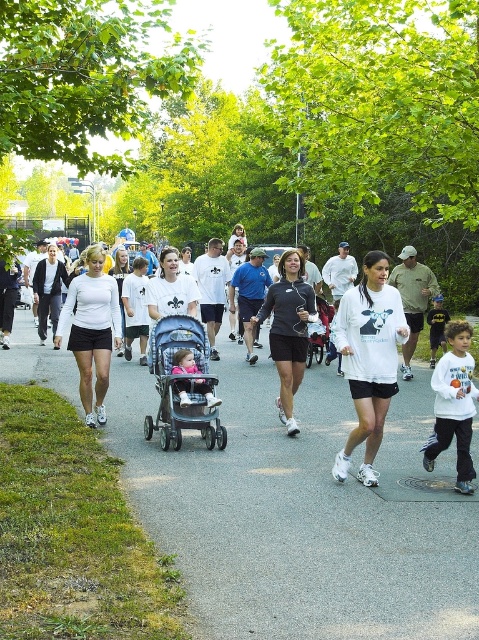
Can you confirm if matte pink stroller at center is positioned to the right of white matte t-shirt at center?

Indeed, matte pink stroller at center is positioned on the right side of white matte t-shirt at center.

Which is behind, point (187, 385) or point (121, 285)?

Positioned behind is point (121, 285).

At what (x,y) coordinates should I click in order to perform the action: click on matte pink stroller at center. Please return your answer as a coordinate pair (x, y). Looking at the image, I should click on (183, 362).

Is white matte long-sleeve shirt at center to the left of white matte shorts at center from the viewer's perspective?

No, white matte long-sleeve shirt at center is not to the left of white matte shorts at center.

What do you see at coordinates (368, 358) in the screenshot? I see `white matte long-sleeve shirt at center` at bounding box center [368, 358].

I want to click on white matte long-sleeve shirt at center, so click(x=368, y=358).

Does blue fabric stroller at center have a larger size compared to matte pink stroller at center?

Yes, blue fabric stroller at center is bigger than matte pink stroller at center.

Between blue fabric stroller at center and matte pink stroller at center, which one is positioned higher?

matte pink stroller at center is above.

Is point (201, 324) positioned after point (177, 385)?

Yes, point (201, 324) is farther from viewer.

Locate an element on the screen. This screenshot has height=640, width=479. blue fabric stroller at center is located at coordinates (182, 385).